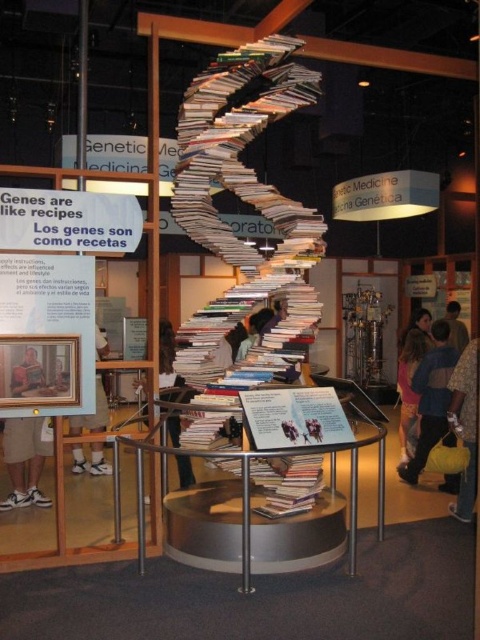
Question: Which object is farther from the camera taking this photo?

Choices:
 (A) pink fabric dress at lower right
 (B) tan shorts at lower left
 (C) dark brown hair at upper right
 (D) dark blue jeans at center

Answer: (C)

Question: Among these points, which one is farthest from the camera?

Choices:
 (A) (165, 337)
 (B) (399, 394)

Answer: (B)

Question: Can you confirm if tan shorts at lower left is positioned to the right of dark brown hair at upper right?

Choices:
 (A) no
 (B) yes

Answer: (A)

Question: Does pink fabric dress at lower right have a larger size compared to dark brown hair at upper right?

Choices:
 (A) no
 (B) yes

Answer: (B)

Question: From the image, what is the correct spatial relationship of pink fabric dress at lower right in relation to dark blue jeans at center?

Choices:
 (A) above
 (B) below

Answer: (B)

Question: Which of the following is the closest to the observer?

Choices:
 (A) pink fabric dress at lower right
 (B) dark blue jeans at center
 (C) blue denim jacket at lower right
 (D) white sneakers at lower left

Answer: (B)